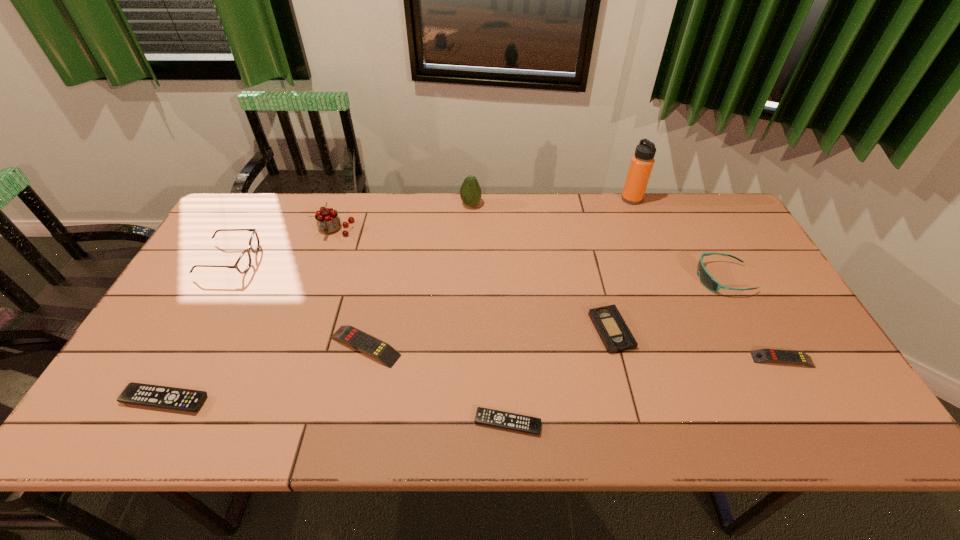
Image resolution: width=960 pixels, height=540 pixels. What are the coordinates of `free location located on the front-facing side of the cyan sunglasses` in the screenshot? It's located at (602, 279).

Image resolution: width=960 pixels, height=540 pixels. In order to click on free space located on the front-facing side of the cyan sunglasses in this screenshot , I will do `click(619, 279)`.

You are a GUI agent. You are given a task and a screenshot of the screen. Output one action in this format:
    pyautogui.click(x=<x>, y=<y>)
    Task: Click on the vacant space situated on the front-facing side of the cyan sunglasses
    The image size is (960, 540).
    Given the screenshot: What is the action you would take?
    pyautogui.click(x=623, y=279)

Find the location of a particular element. This screenshot has width=960, height=540. free space located on the right of the seventh object from right to left is located at coordinates (558, 346).

Identify the location of vacant point located 0.120m on the back of the smaller yellow remote control. The width and height of the screenshot is (960, 540). (756, 314).

The width and height of the screenshot is (960, 540). I want to click on free space located 0.180m on the front of the videotape, so click(635, 423).

Where is `blank space located 0.120m on the back of the left black remote control`? This screenshot has height=540, width=960. blank space located 0.120m on the back of the left black remote control is located at coordinates (196, 343).

Identify the location of free spot located on the back of the right black remote control. (502, 293).

You are a GUI agent. You are given a task and a screenshot of the screen. Output one action in this format:
    pyautogui.click(x=<x>, y=<y>)
    Task: Click on the thermos bottle present at the far edge
    The width and height of the screenshot is (960, 540).
    Given the screenshot: What is the action you would take?
    pyautogui.click(x=642, y=162)

Where is `avocado at the far edge`? The height and width of the screenshot is (540, 960). avocado at the far edge is located at coordinates (470, 192).